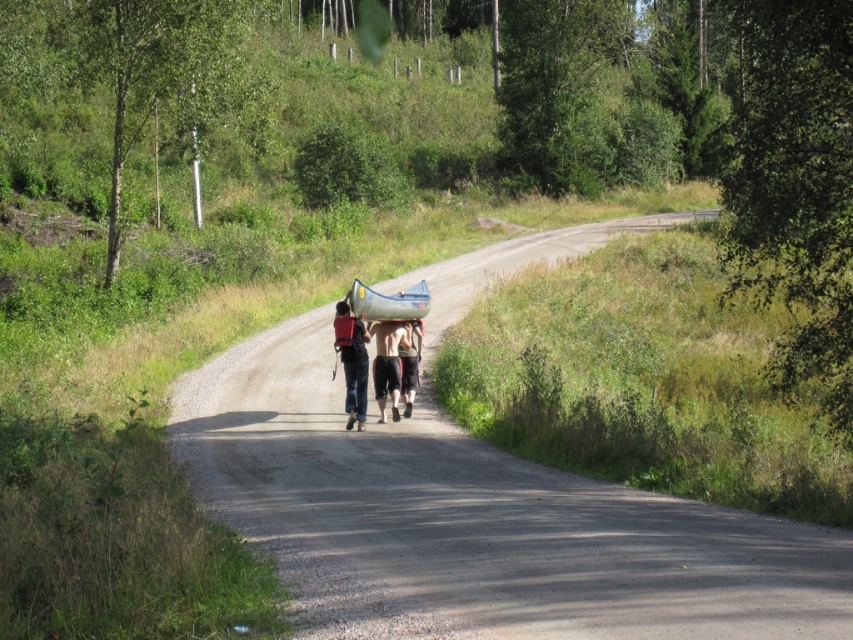
You are standing at the point marked by the coordinates point (379, 282). You want to walk to the gravel road that is visible in the scene. How far will you have to walk to reach the gravel road?

The distance between point (379, 282) and the viewer is 96.95 feet. Since the viewer is at the gravel road, you need to walk 96.95 feet to reach it.

You are standing on the gravel road and see two points marked on the ground in front of you. The first point is at coordinate point (343, 321) and the second point is at coordinate point (374, 291). Which point is closer to you?

The point at coordinate point (343, 321) is closer to you than the point at coordinate point (374, 291).

You are a hiker planning to walk along the gravel road. You see the matte blue jeans at center and the green rubber canoe at center. Which object is closer to the ground?

The matte blue jeans at center is located below green rubber canoe at center, so the matte blue jeans at center is closer to the ground.